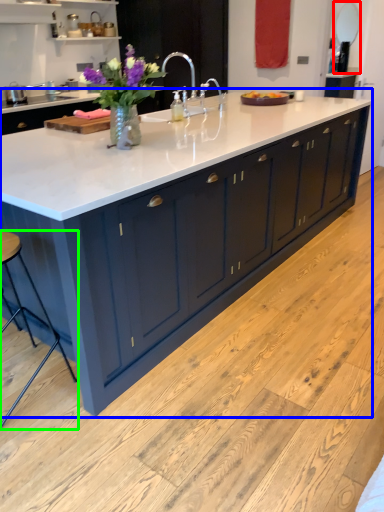
Question: Which object is positioned closest to mirror (highlighted by a red box)? Select from countertop (highlighted by a blue box) and bar stool (highlighted by a green box).

Choices:
 (A) countertop
 (B) bar stool

Answer: (A)